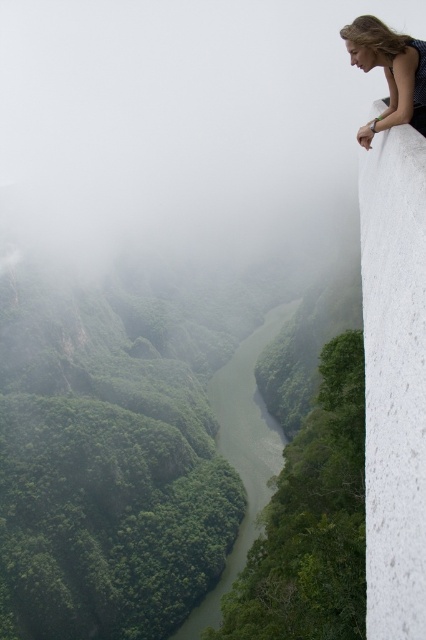
Question: Is white speckled concrete cliff at upper right smaller than green leafy river at center?

Choices:
 (A) yes
 (B) no

Answer: (A)

Question: Does green leafy river at center appear over blue dotted dress at upper right?

Choices:
 (A) yes
 (B) no

Answer: (B)

Question: Which point is farther to the camera?

Choices:
 (A) (385, 488)
 (B) (273, 465)

Answer: (B)

Question: Which object is farther from the camera taking this photo?

Choices:
 (A) blue dotted dress at upper right
 (B) white speckled concrete cliff at upper right

Answer: (A)

Question: From the image, what is the correct spatial relationship of green leafy river at center in relation to blue dotted dress at upper right?

Choices:
 (A) above
 (B) below

Answer: (B)

Question: Which object is positioned closest to the white speckled concrete cliff at upper right?

Choices:
 (A) green leafy river at center
 (B) blue dotted dress at upper right

Answer: (B)